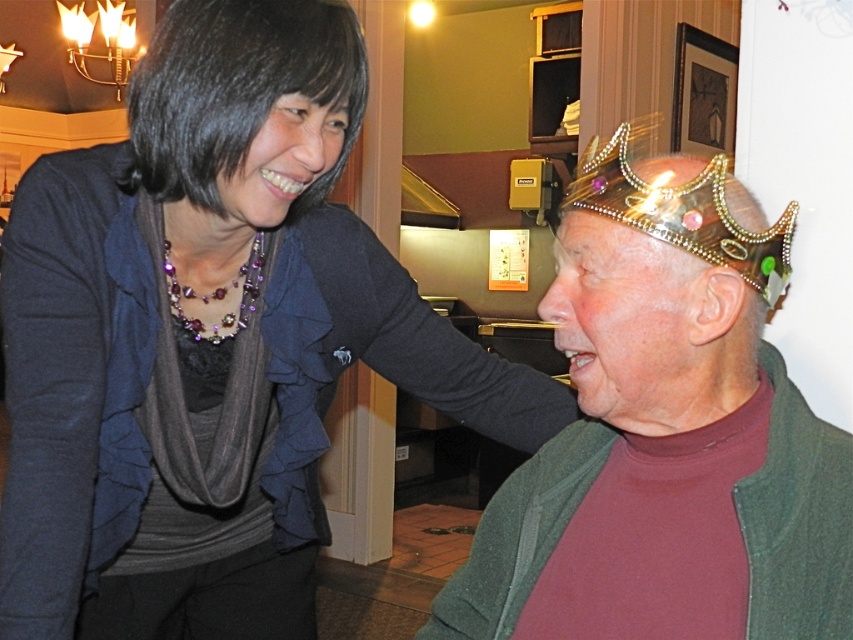
Which of these two, matte black scarf at upper left or gold glittery tiara at upper center, stands shorter?

gold glittery tiara at upper center

What do you see at coordinates (209, 339) in the screenshot? I see `matte black scarf at upper left` at bounding box center [209, 339].

Image resolution: width=853 pixels, height=640 pixels. What do you see at coordinates (209, 339) in the screenshot? I see `matte black scarf at upper left` at bounding box center [209, 339].

Locate an element on the screen. The height and width of the screenshot is (640, 853). matte black scarf at upper left is located at coordinates (209, 339).

Between shiny metallic crown at right and gold glittery tiara at upper center, which one appears on the right side from the viewer's perspective?

Positioned to the right is shiny metallic crown at right.

Looking at this image, can you confirm if shiny metallic crown at right is bigger than gold glittery tiara at upper center?

Yes, shiny metallic crown at right is bigger than gold glittery tiara at upper center.

Does point (784, 256) come in front of point (718, 244)?

No, (784, 256) is further to viewer.

Image resolution: width=853 pixels, height=640 pixels. Find the location of `shiny metallic crown at right`. shiny metallic crown at right is located at coordinates (665, 436).

Which is more to the left, matte black scarf at upper left or shiny metallic crown at right?

matte black scarf at upper left is more to the left.

The width and height of the screenshot is (853, 640). Identify the location of matte black scarf at upper left. (209, 339).